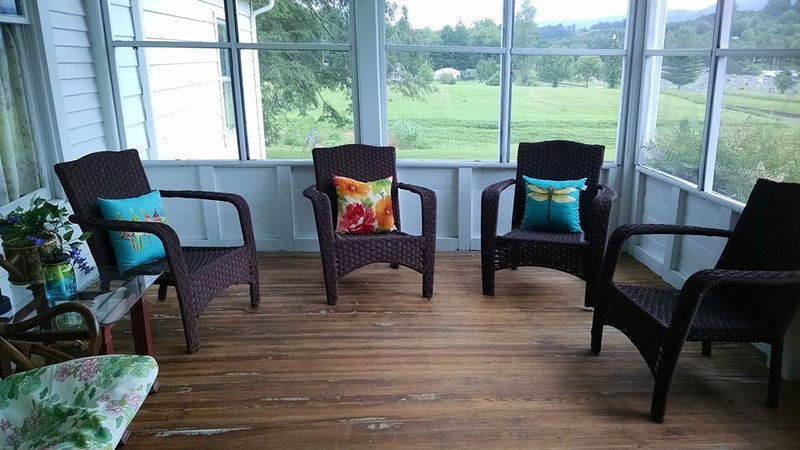
Locate an element on the screen. The width and height of the screenshot is (800, 450). wicker is located at coordinates (562, 166).